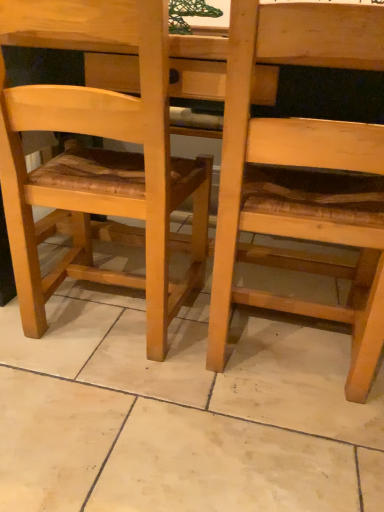
Question: Should I look upward or downward to see natural wood chair at center?

Choices:
 (A) down
 (B) up

Answer: (B)